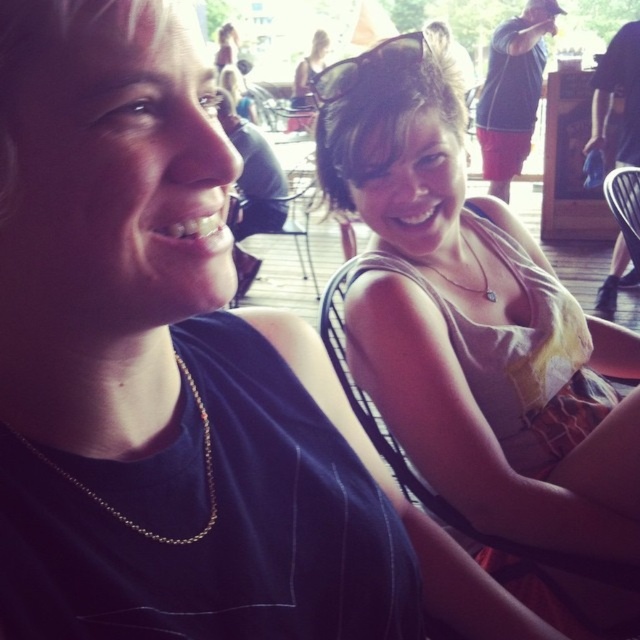
You are a photographer adjusting your camera settings. You notice the black plastic sunglasses at upper center and the gold chain necklace at left in your viewfinder. Which object is closer to your camera?

The black plastic sunglasses at upper center is closer to the camera than the gold chain necklace at left because it is further to the viewer.

You are standing at the position of the point at coordinates point (321, 81) and want to walk towards the point at coordinates point (448, 280). Which direction should you move to get closer to the second point?

To move from point (321, 81) towards point (448, 280), you should move northeast since the second point is northeast of the first point.

You are standing at the point marked as point (323, 88) in the image. You want to walk to the entrance of the outdoor area, which is located 5 feet away from your current position. Can you reach the entrance without moving more than 5 feet?

The distance between point (323, 88) and the viewer is 3.56 feet. Since the entrance is 5 feet away from your current position, you can reach it without moving more than 5 feet because 3.56 feet is less than 5 feet.